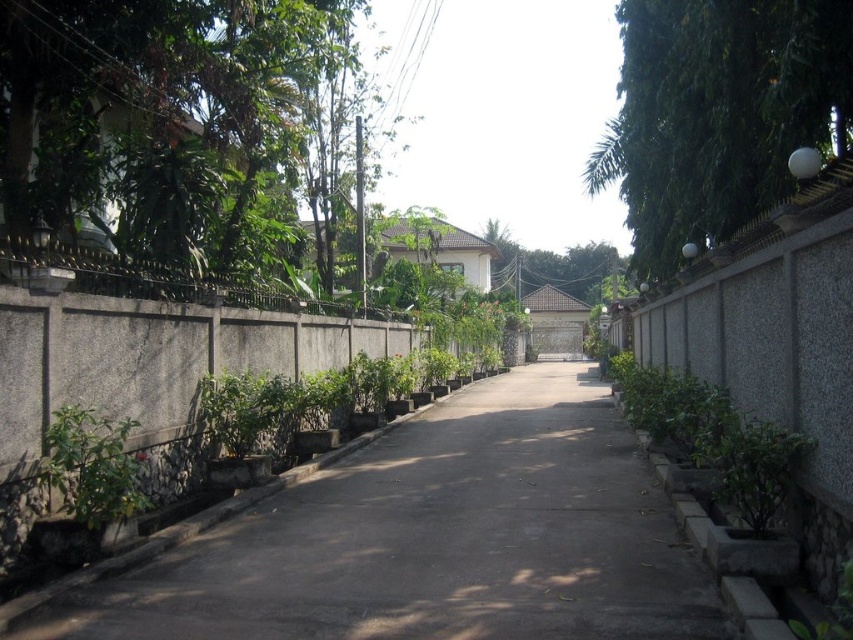
Question: From the image, what is the correct spatial relationship of gray concrete pavement at center in relation to green leafy plant at lower left?

Choices:
 (A) left
 (B) right

Answer: (B)

Question: Which point is closer to the camera?

Choices:
 (A) green leafy tree at right
 (B) green leafy tree at center

Answer: (A)

Question: Among these objects, which one is nearest to the camera?

Choices:
 (A) green leafy tree at right
 (B) gray concrete pavement at center
 (C) green leafy tree at left

Answer: (B)

Question: Is gray concrete pavement at center below green leafy tree at left?

Choices:
 (A) yes
 (B) no

Answer: (A)

Question: Considering the relative positions of gray concrete pavement at center and green leafy tree at left in the image provided, where is gray concrete pavement at center located with respect to green leafy tree at left?

Choices:
 (A) below
 (B) above

Answer: (A)

Question: Which of these objects is positioned closest to the green leafy tree at center?

Choices:
 (A) green leafy tree at right
 (B) green leafy tree at left
 (C) gray concrete pavement at center
 (D) green leafy plant at lower left

Answer: (A)